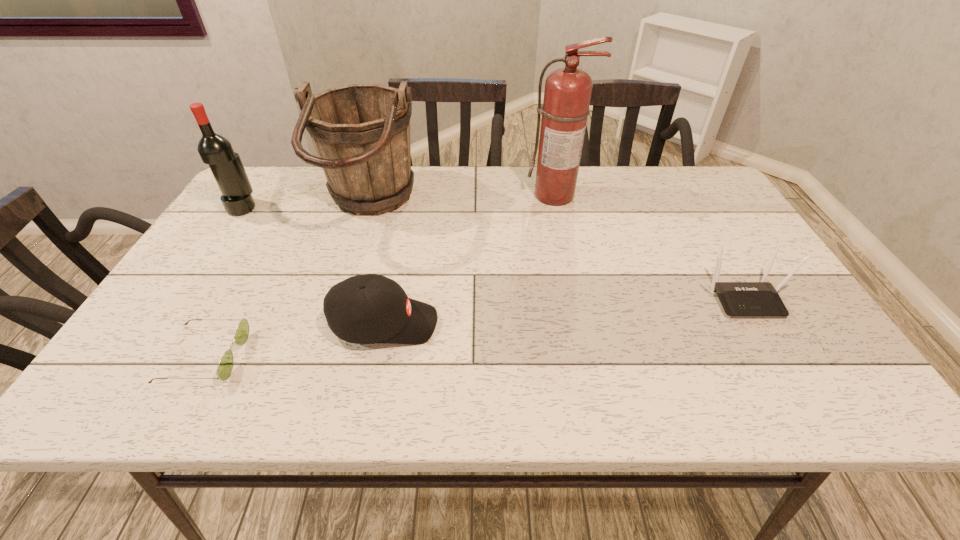
What are the coordinates of `the tallest object` in the screenshot? It's located at (567, 94).

At what (x,y) coordinates should I click in order to perform the action: click on the second object from right to left. Please return your answer as a coordinate pair (x, y). Looking at the image, I should click on (567, 94).

This screenshot has height=540, width=960. What are the coordinates of `bucket` in the screenshot? It's located at (361, 132).

Where is `the leftmost object`? the leftmost object is located at coordinates (215, 150).

At what (x,y) coordinates should I click in order to perform the action: click on baseball cap. Please return your answer as a coordinate pair (x, y). Looking at the image, I should click on (370, 308).

Where is `the rightmost object`? This screenshot has width=960, height=540. the rightmost object is located at coordinates (739, 299).

Where is `the second object from left to right`? The width and height of the screenshot is (960, 540). the second object from left to right is located at coordinates (225, 367).

The image size is (960, 540). I want to click on sunglasses, so click(x=225, y=367).

Locate an element on the screen. free space located on the front-facing side of the tallest object is located at coordinates (561, 221).

You are a GUI agent. You are given a task and a screenshot of the screen. Output one action in this format:
    pyautogui.click(x=<x>, y=<y>)
    Task: Click on the free space located 0.340m on the handle side of the bucket
    The image size is (960, 540).
    Given the screenshot: What is the action you would take?
    pyautogui.click(x=535, y=207)